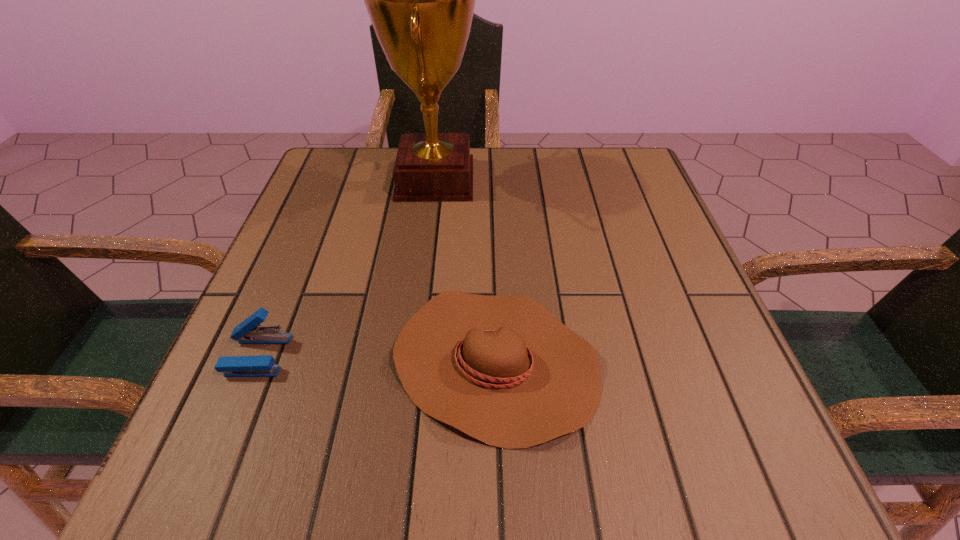
Image resolution: width=960 pixels, height=540 pixels. I want to click on vacant space that satisfies the following two spatial constraints: 1. on the plaque of the tallest object; 2. on the back side of the cowboy hat, so click(x=413, y=362).

Find the location of a particular element. Image resolution: width=960 pixels, height=540 pixels. free region that satisfies the following two spatial constraints: 1. on the plaque of the award; 2. on the right side of the cowboy hat is located at coordinates (413, 362).

You are a GUI agent. You are given a task and a screenshot of the screen. Output one action in this format:
    pyautogui.click(x=<x>, y=<y>)
    Task: Click on the vacant point that satisfies the following two spatial constraints: 1. on the back side of the shortest object; 2. on the plaque of the farthest object
    This screenshot has width=960, height=540.
    Given the screenshot: What is the action you would take?
    pyautogui.click(x=490, y=179)

Where is `vacant space that satisfies the following two spatial constraints: 1. on the plaque of the cowboy hat; 2. on the left side of the tallest object`? This screenshot has height=540, width=960. vacant space that satisfies the following two spatial constraints: 1. on the plaque of the cowboy hat; 2. on the left side of the tallest object is located at coordinates (413, 362).

Where is `vacant space that satisfies the following two spatial constraints: 1. on the front side of the cowboy hat; 2. on the left side of the leftmost object`? Image resolution: width=960 pixels, height=540 pixels. vacant space that satisfies the following two spatial constraints: 1. on the front side of the cowboy hat; 2. on the left side of the leftmost object is located at coordinates (254, 362).

Find the location of a particular element. This screenshot has height=540, width=960. free spot that satisfies the following two spatial constraints: 1. on the plaque of the farthest object; 2. on the right side of the shortest object is located at coordinates (413, 362).